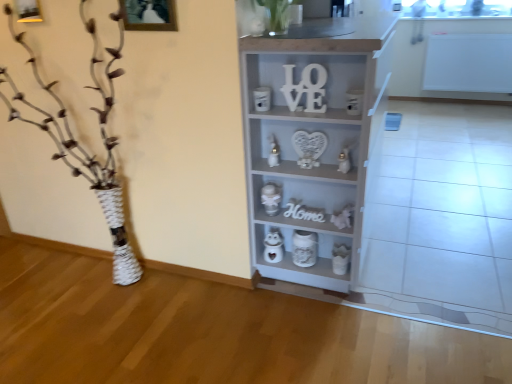
This screenshot has height=384, width=512. Describe the element at coordinates (277, 15) in the screenshot. I see `green matte plant at upper center` at that location.

What do you see at coordinates (273, 152) in the screenshot? I see `white glossy candle at center, arranged as the 1th toy when viewed from the top` at bounding box center [273, 152].

Describe the element at coordinates (304, 212) in the screenshot. I see `white wood letter at center, which is the 1th letter in back-to-front order` at that location.

Describe the element at coordinates (340, 258) in the screenshot. I see `white glossy owl at lower center, which is counted as the first toy, starting from the bottom` at that location.

Find the location of a particular element. The image size is (512, 384). white wooden letter at upper center, which appears as the second letter when ordered from the bottom is located at coordinates (305, 88).

What are the coordinates of `white matte cat at lower center, positioned as the fourth toy in top-to-bottom order` in the screenshot? It's located at [342, 217].

Find the location of a particular element. This screenshot has width=512, height=384. green matte plant at upper center is located at coordinates (277, 15).

Considering the sizes of objects white textured vase at left and white glossy figurine at center, marked as the 2th toy in a top-to-bottom arrangement, in the image provided, who is taller, white textured vase at left or white glossy figurine at center, marked as the 2th toy in a top-to-bottom arrangement,?

Standing taller between the two is white textured vase at left.

Looking at their sizes, would you say white textured vase at left is wider or thinner than white glossy figurine at center, marked as the 5th toy in a bottom-to-top arrangement?

In the image, white textured vase at left appears to be wider than white glossy figurine at center, marked as the 5th toy in a bottom-to-top arrangement.

Consider the image. From the image's perspective, relative to white glossy figurine at center, marked as the 2th toy in a top-to-bottom arrangement, is white textured vase at left above or below?

From the image's perspective, white textured vase at left appears below white glossy figurine at center, marked as the 2th toy in a top-to-bottom arrangement.

Could white glossy figurine at center, marked as the 2th toy in a top-to-bottom arrangement, be considered to be inside white textured vase at left?

Actually, white glossy figurine at center, marked as the 2th toy in a top-to-bottom arrangement, is outside white textured vase at left.

Considering the points (343, 162) and (270, 164), which point is in front, point (343, 162) or point (270, 164)?

The point (343, 162) is closer.

From a real-world perspective, who is located lower, white glossy figurine at center, marked as the 2th toy in a top-to-bottom arrangement, or white glossy candle at center, arranged as the 1th toy when viewed from the top?

white glossy figurine at center, marked as the 2th toy in a top-to-bottom arrangement.

Could you tell me if white glossy figurine at center, marked as the 2th toy in a top-to-bottom arrangement, is facing white glossy candle at center, arranged as the 1th toy when viewed from the top?

No, white glossy figurine at center, marked as the 2th toy in a top-to-bottom arrangement, does not turn towards white glossy candle at center, arranged as the 1th toy when viewed from the top.

Are metallic silver toy at center, the third toy viewed from the top, and wooden picture frame at upper center making contact?

There is a gap between metallic silver toy at center, the third toy viewed from the top, and wooden picture frame at upper center.

Which point is more forward, (274, 208) or (176, 30)?

Point (176, 30)

Is metallic silver toy at center, placed as the fourth toy when sorted from bottom to top, thinner than wooden picture frame at upper center?

In fact, metallic silver toy at center, placed as the fourth toy when sorted from bottom to top, might be wider than wooden picture frame at upper center.

From a real-world perspective, does white glossy figurine at center, marked as the 5th toy in a bottom-to-top arrangement, stand above white glossy owl at lower center, which ranks as the 6th toy in top-to-bottom order?

Correct, in the physical world, white glossy figurine at center, marked as the 5th toy in a bottom-to-top arrangement, is higher than white glossy owl at lower center, which ranks as the 6th toy in top-to-bottom order.

Does point (346, 148) come behind point (348, 251)?

No, it is in front of (348, 251).

Considering the positions of objects white glossy figurine at center, marked as the 2th toy in a top-to-bottom arrangement, and white glossy owl at lower center, which is counted as the first toy, starting from the bottom, in the image provided, who is more to the right, white glossy figurine at center, marked as the 2th toy in a top-to-bottom arrangement, or white glossy owl at lower center, which is counted as the first toy, starting from the bottom,?

Positioned to the right is white glossy owl at lower center, which is counted as the first toy, starting from the bottom.

Considering the sizes of objects white glossy figurine at center, marked as the 2th toy in a top-to-bottom arrangement, and white glossy owl at lower center, which is counted as the first toy, starting from the bottom, in the image provided, who is wider, white glossy figurine at center, marked as the 2th toy in a top-to-bottom arrangement, or white glossy owl at lower center, which is counted as the first toy, starting from the bottom,?

white glossy owl at lower center, which is counted as the first toy, starting from the bottom, is wider.

Is white glossy heart at center, which appears as the fifth toy when viewed from the top, shorter than white wood letter at center, which ranks as the 2th letter in front-to-back order?

No.

Are white glossy heart at center, which appears as the fifth toy when viewed from the top, and white wood letter at center, which ranks as the 2th letter in front-to-back order, beside each other?

No.

Considering the positions of objects white glossy heart at center, the second toy from the bottom, and white wood letter at center, which ranks as the 1th letter in bottom-to-top order, in the image provided, who is more to the right, white glossy heart at center, the second toy from the bottom, or white wood letter at center, which ranks as the 1th letter in bottom-to-top order,?

white wood letter at center, which ranks as the 1th letter in bottom-to-top order.

Who is bigger, white glossy heart at center, which appears as the fifth toy when viewed from the top, or white wood letter at center, which ranks as the 2th letter in top-to-bottom order?

Bigger between the two is white glossy heart at center, which appears as the fifth toy when viewed from the top.

Would you say white glossy heart at center, the second toy from the bottom, contains white glossy owl at lower center, which is counted as the first toy, starting from the bottom?

No, white glossy heart at center, the second toy from the bottom, does not contain white glossy owl at lower center, which is counted as the first toy, starting from the bottom.

Between white glossy heart at center, the second toy from the bottom, and white glossy owl at lower center, which ranks as the 6th toy in top-to-bottom order, which one has more height?

white glossy heart at center, the second toy from the bottom, is taller.

Is white glossy heart at center, the second toy from the bottom, thinner than white glossy owl at lower center, which is counted as the first toy, starting from the bottom?

Indeed, white glossy heart at center, the second toy from the bottom, has a lesser width compared to white glossy owl at lower center, which is counted as the first toy, starting from the bottom.

Is white glossy heart at center, which appears as the fifth toy when viewed from the top, beside white glossy owl at lower center, which is counted as the first toy, starting from the bottom?

No.

The image size is (512, 384). In order to click on the 1st toy to the left of the white painted wood shelf at center, counting from the anchor's position in this screenshot , I will do `click(273, 246)`.

Is white glossy heart at center, the second toy from the bottom, at the right side of white painted wood shelf at center?

No.

Is white glossy heart at center, which appears as the fifth toy when viewed from the top, turned away from white painted wood shelf at center?

Yes, white glossy heart at center, which appears as the fifth toy when viewed from the top, is facing away from white painted wood shelf at center.

The width and height of the screenshot is (512, 384). I want to click on floral arrangement lying on the left of white glossy figurine at center, marked as the 2th toy in a top-to-bottom arrangement, so click(81, 146).

In the image, there is a white glossy figurine at center, marked as the 2th toy in a top-to-bottom arrangement. Identify the location of toy above it (from the image's perspective). (273, 152).

Considering their positions, is white glossy figurine at center, marked as the 5th toy in a bottom-to-top arrangement, positioned closer to white painted wood shelf at center than white glossy owl at lower center, which is counted as the first toy, starting from the bottom?

The object closer to white painted wood shelf at center is white glossy figurine at center, marked as the 5th toy in a bottom-to-top arrangement.

Which object lies nearer to the anchor point metallic silver toy at center, placed as the fourth toy when sorted from bottom to top, white textured vase at left or white glossy heart at center, which appears as the fifth toy when viewed from the top?

Based on the image, white glossy heart at center, which appears as the fifth toy when viewed from the top, appears to be nearer to metallic silver toy at center, placed as the fourth toy when sorted from bottom to top.

Looking at the image, which one is located further to wooden picture frame at upper center, white painted wood shelf at center or white matte cat at lower center, positioned as the fourth toy in top-to-bottom order?

white matte cat at lower center, positioned as the fourth toy in top-to-bottom order.

Which object lies further to the anchor point metallic silver toy at center, placed as the fourth toy when sorted from bottom to top, white glossy owl at lower center, which ranks as the 6th toy in top-to-bottom order, or wooden picture frame at upper center?

wooden picture frame at upper center.

Estimate the real-world distances between objects in this image. Which object is further from white textured vase at left, white glossy owl at lower center, which ranks as the 6th toy in top-to-bottom order, or white wood letter at center, which is the 1th letter in back-to-front order?

white glossy owl at lower center, which ranks as the 6th toy in top-to-bottom order.

Based on their spatial positions, is white wood letter at center, which ranks as the 2th letter in front-to-back order, or white matte cat at lower center, positioned as the fourth toy in top-to-bottom order, further from metallic silver toy at center, placed as the fourth toy when sorted from bottom to top?

white matte cat at lower center, positioned as the fourth toy in top-to-bottom order, lies further to metallic silver toy at center, placed as the fourth toy when sorted from bottom to top, than the other object.

Which object lies further to the anchor point white painted wood shelf at center, white glossy owl at lower center, which is counted as the first toy, starting from the bottom, or white glossy figurine at center, marked as the 5th toy in a bottom-to-top arrangement?

white glossy owl at lower center, which is counted as the first toy, starting from the bottom.

From the image, which object appears to be nearer to wooden picture frame at upper center, white glossy heart at center, the second toy from the bottom, or white glossy candle at center, arranged as the 1th toy when viewed from the top?

white glossy candle at center, arranged as the 1th toy when viewed from the top, is closer to wooden picture frame at upper center.

Where is `plant located between wooden picture frame at upper center and white glossy figurine at center, marked as the 5th toy in a bottom-to-top arrangement, in the left-right direction`? The image size is (512, 384). plant located between wooden picture frame at upper center and white glossy figurine at center, marked as the 5th toy in a bottom-to-top arrangement, in the left-right direction is located at coordinates (277, 15).

You are a GUI agent. You are given a task and a screenshot of the screen. Output one action in this format:
    pyautogui.click(x=<x>, y=<y>)
    Task: Click on the shelf between white wooden letter at upper center, positioned as the first letter in front-to-back order, and white wood letter at center, which ranks as the 2th letter in top-to-bottom order, in the vertical direction
    
    Given the screenshot: What is the action you would take?
    pyautogui.click(x=314, y=135)

Locate an element on the screen. The height and width of the screenshot is (384, 512). picture frame between green matte plant at upper center and white glossy heart at center, which appears as the fifth toy when viewed from the top, from top to bottom is located at coordinates (149, 15).

Where is `picture frame between green matte plant at upper center and white matte cat at lower center, positioned as the fourth toy in top-to-bottom order, in the up-down direction`? The image size is (512, 384). picture frame between green matte plant at upper center and white matte cat at lower center, positioned as the fourth toy in top-to-bottom order, in the up-down direction is located at coordinates (149, 15).